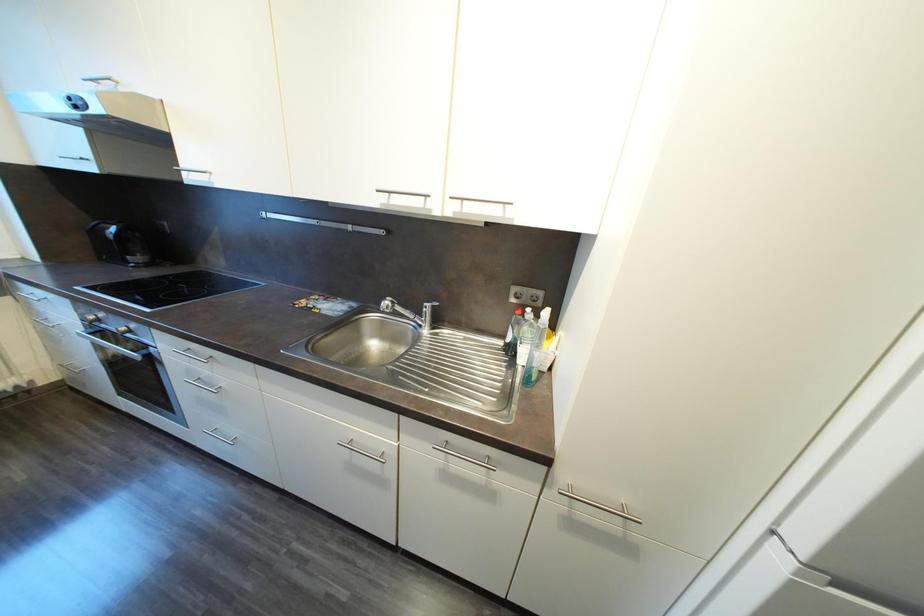
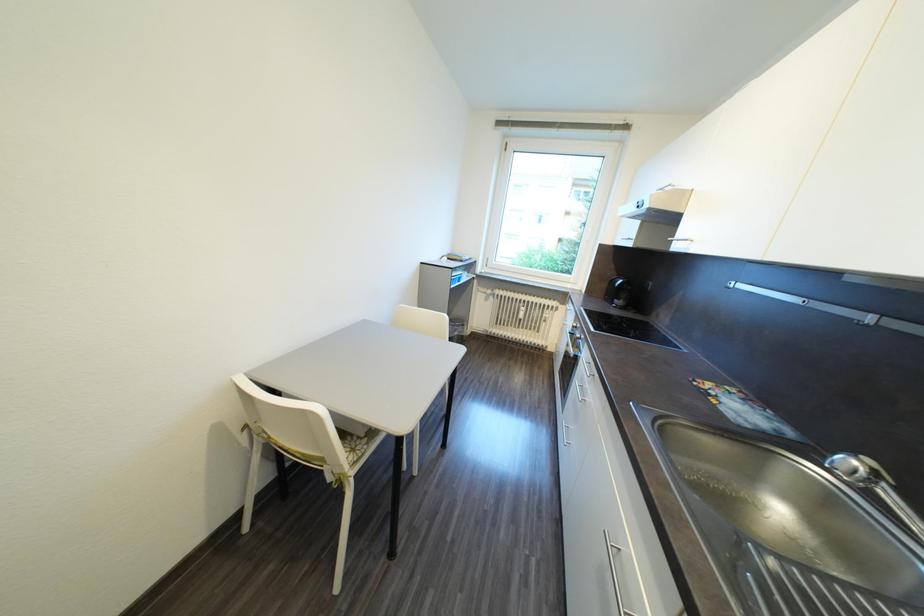
Question: How did the camera likely rotate?

Choices:
 (A) Left
 (B) Right
 (C) Up
 (D) Down

Answer: (A)